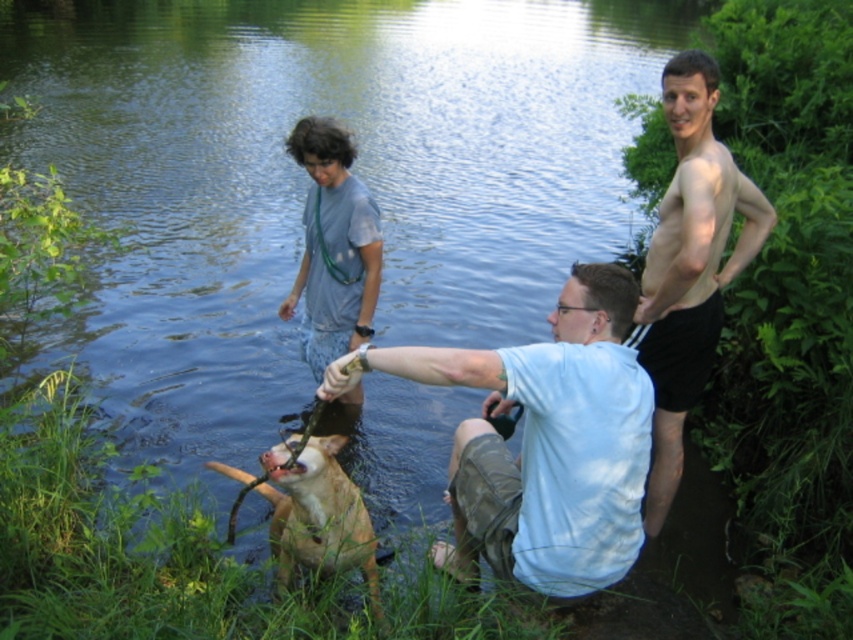
Question: Where is light blue shirt at center located in relation to gray cotton shirt at center in the image?

Choices:
 (A) below
 (B) above

Answer: (A)

Question: Does light blue shirt at center appear under gray cotton shirt at center?

Choices:
 (A) yes
 (B) no

Answer: (A)

Question: Which of the following is the closest to the observer?

Choices:
 (A) (711, 164)
 (B) (346, 221)
 (C) (399, 374)

Answer: (C)

Question: Which of the following is the farthest from the observer?

Choices:
 (A) tan leather dog at lower center
 (B) light blue shirt at center
 (C) skinny tan skin at right

Answer: (C)

Question: Does light blue shirt at center lie behind tan leather dog at lower center?

Choices:
 (A) yes
 (B) no

Answer: (B)

Question: Among these points, which one is nearest to the camera?

Choices:
 (A) (321, 356)
 (B) (653, 372)
 (C) (276, 497)

Answer: (B)